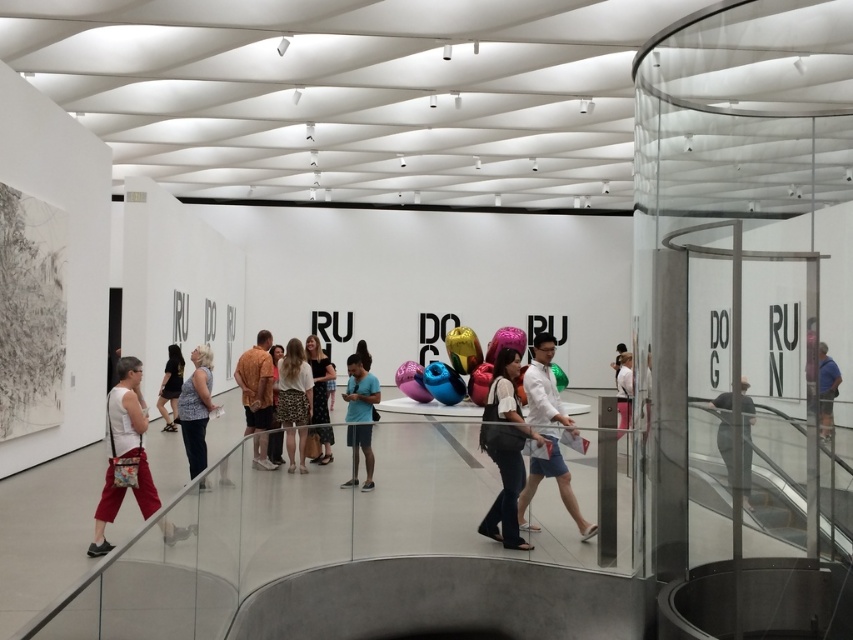
Question: Based on their relative distances, which object is farther from the blue matte shirt at center?

Choices:
 (A) brown textured shirt at center
 (B) white cotton shirt at center
 (C) matte black dress at center
 (D) matte pink helmet at center

Answer: (C)

Question: Which of the following is the farthest from the observer?

Choices:
 (A) (328, 460)
 (B) (624, 380)
 (C) (283, 392)
 (D) (252, 360)

Answer: (B)

Question: Is white textured skirt at center behind blue fabric pants at right?

Choices:
 (A) no
 (B) yes

Answer: (B)

Question: Does denim pants at center have a lesser width compared to matte black dress at center?

Choices:
 (A) no
 (B) yes

Answer: (B)

Question: Is matte pink helmet at center thinner than white textured skirt at center?

Choices:
 (A) no
 (B) yes

Answer: (A)

Question: Which point is farther to the camera?

Choices:
 (A) (500, 461)
 (B) (279, 390)

Answer: (B)